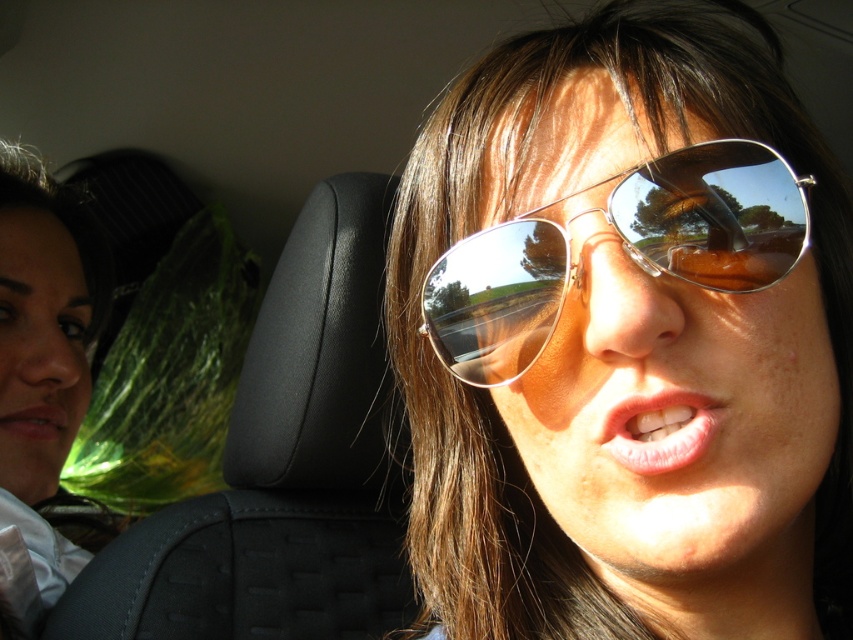
Based on the photo, does matte white shirt at left have a greater width compared to matte pink lips at lower left?

Yes.

This screenshot has height=640, width=853. Describe the element at coordinates (45, 288) in the screenshot. I see `matte white shirt at left` at that location.

Does point (25, 595) lie behind point (45, 436)?

No, (25, 595) is closer to viewer.

I want to click on matte white shirt at left, so click(45, 288).

How distant is silver reflective goggles at center from matte white shirt at left?

A distance of 21.82 inches exists between silver reflective goggles at center and matte white shirt at left.

Between point (622, 193) and point (57, 563), which one is positioned behind?

Positioned behind is point (57, 563).

Is point (712, 266) behind point (33, 250)?

That is False.

You are a GUI agent. You are given a task and a screenshot of the screen. Output one action in this format:
    pyautogui.click(x=<x>, y=<y>)
    Task: Click on the silver reflective goggles at center
    
    Given the screenshot: What is the action you would take?
    pyautogui.click(x=621, y=248)

Where is `shiny silver sunglasses at center`? Image resolution: width=853 pixels, height=640 pixels. shiny silver sunglasses at center is located at coordinates (625, 337).